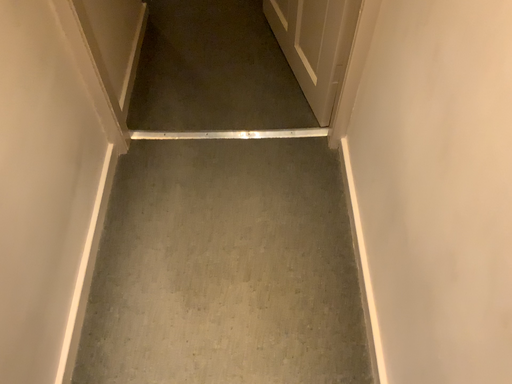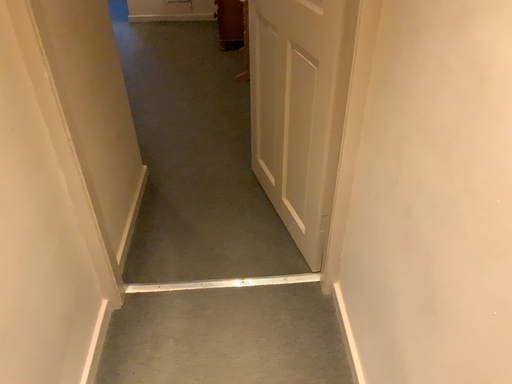
Question: Which way did the camera rotate in the video?

Choices:
 (A) rotated upward
 (B) rotated downward

Answer: (A)